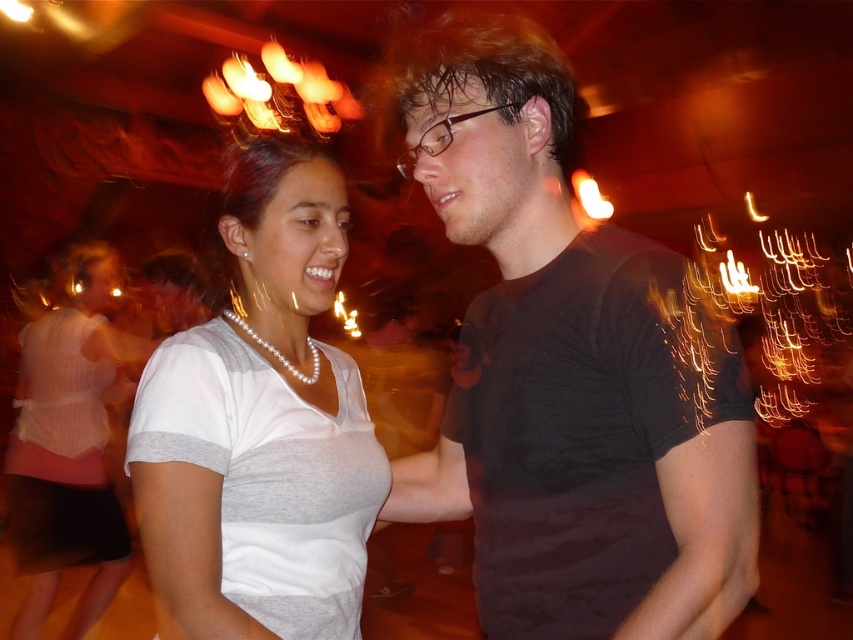
Who is more forward, (509, 64) or (91, 369)?

Positioned in front is point (509, 64).

Which is in front, point (395, 461) or point (79, 332)?

Positioned in front is point (395, 461).

This screenshot has width=853, height=640. I want to click on black matte shirt at center, so click(x=564, y=369).

I want to click on white pearl necklace at center, so click(260, 426).

What are the coordinates of `white pearl necklace at center` in the screenshot? It's located at (260, 426).

Is black matte shirt at center closer to the viewer compared to white pearl necklace at center?

Yes, black matte shirt at center is closer to the viewer.

Is point (619, 595) farther from camera compared to point (309, 561)?

No, (619, 595) is closer to viewer.

Does point (636, 397) lie behind point (229, 189)?

No, (636, 397) is closer to viewer.

The width and height of the screenshot is (853, 640). I want to click on black matte shirt at center, so [564, 369].